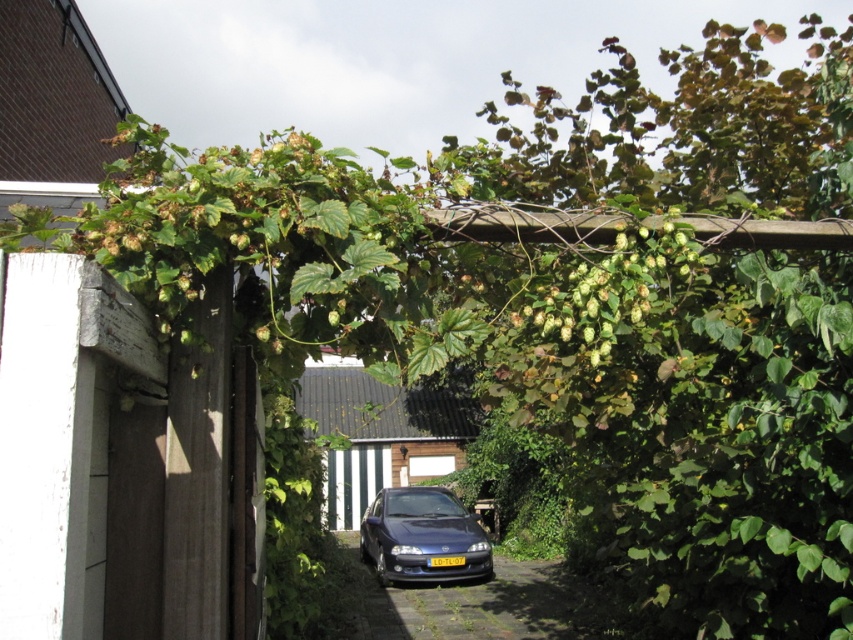
You are driving a car that is 16 feet long. You need to park your car in the alleyway shown in the image. The alley has a black asphalt driveway at center and a shiny dark blue sedan at center. Is there enough space between the driveway and the sedan to park your car?

The black asphalt driveway at center is 5.36 feet from the shiny dark blue sedan at center. Since the distance between them is only 5.36 feet, which is much shorter than the 16 feet length of your car, there is not enough space to park your car between them.

In the scene shown: You are a delivery person with a cart that can move up to 15 meters. You need to reach the black asphalt driveway at center from your current position. Can your cart travel the required distance?

The black asphalt driveway at center is 12.79 meters away from the viewer, so yes, the cart can travel the required distance since it can move up to 15 meters.